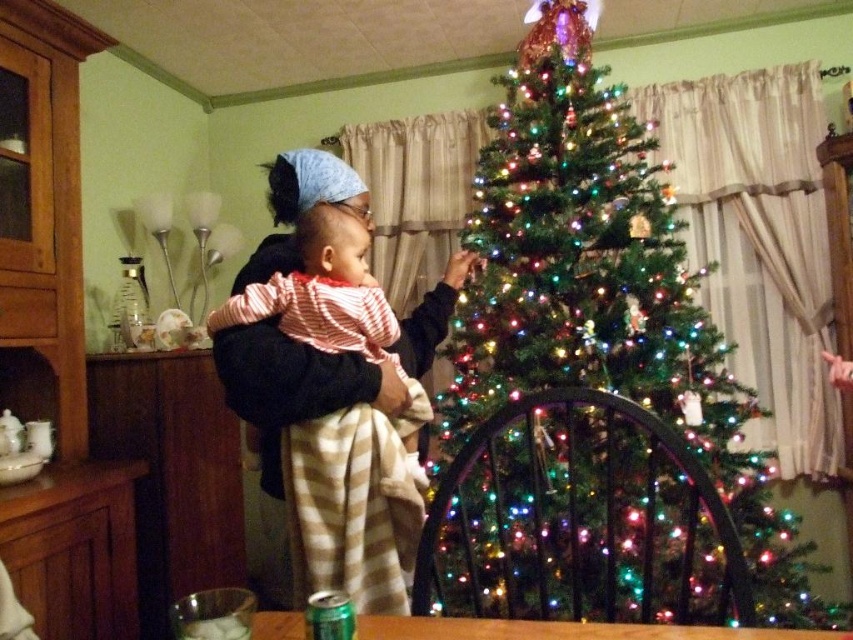
Question: Which object is farther from the camera taking this photo?

Choices:
 (A) green matte christmas tree at center
 (B) striped fabric blanket at center

Answer: (B)

Question: Can you confirm if green matte christmas tree at center is positioned to the right of striped fabric blanket at center?

Choices:
 (A) yes
 (B) no

Answer: (A)

Question: Can you confirm if green matte christmas tree at center is positioned below striped fabric blanket at center?

Choices:
 (A) no
 (B) yes

Answer: (B)

Question: Is green matte christmas tree at center positioned at the back of striped fabric blanket at center?

Choices:
 (A) no
 (B) yes

Answer: (A)

Question: Which point is closer to the camera taking this photo?

Choices:
 (A) (299, 532)
 (B) (755, 458)

Answer: (A)